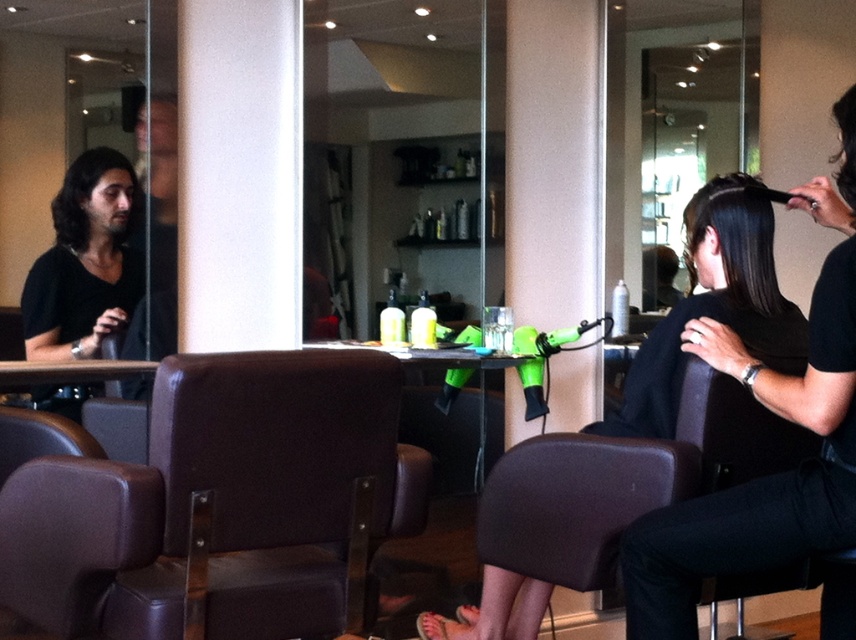
Question: Is the position of matte black shirt at left less distant than that of dark brown wavy hair at left?

Choices:
 (A) yes
 (B) no

Answer: (A)

Question: Is brown leather chair at center further to the viewer compared to smooth black hair at center?

Choices:
 (A) no
 (B) yes

Answer: (A)

Question: Which object is farther from the camera taking this photo?

Choices:
 (A) dark brown wavy hair at left
 (B) matte black shirt at left
 (C) smooth dark brown hair at center

Answer: (A)

Question: Which object is the closest to the smooth dark brown hair at center?

Choices:
 (A) matte black shirt at left
 (B) black matte hairbrush at upper right
 (C) smooth black hair at center
 (D) brown leather chair at center

Answer: (C)

Question: Which object is the closest to the smooth black hair at center?

Choices:
 (A) smooth dark brown hair at center
 (B) matte black shirt at left
 (C) brown leather chair at center
 (D) black matte hairbrush at upper right

Answer: (A)

Question: Is smooth black hair at center smaller than smooth dark brown hair at center?

Choices:
 (A) no
 (B) yes

Answer: (A)